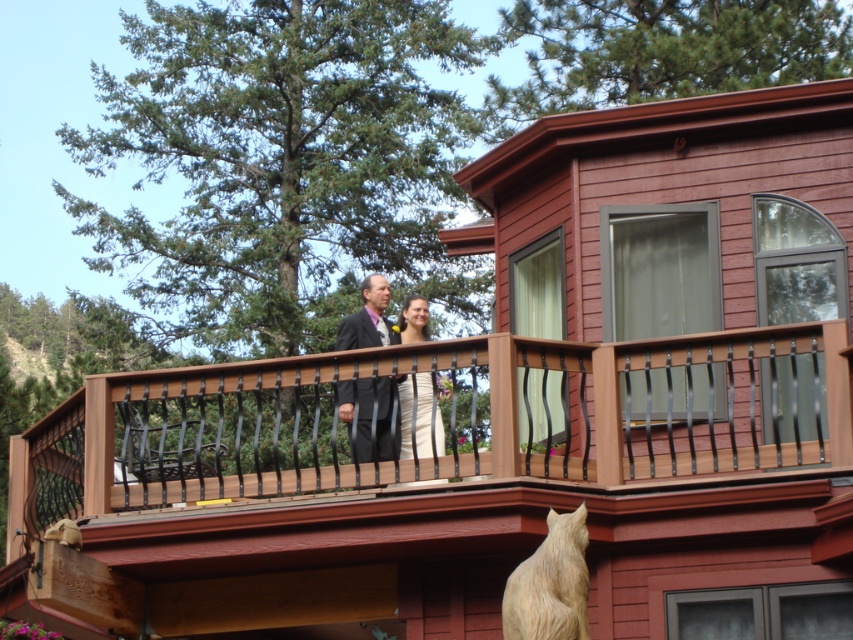
Who is higher up, dark suit at center or white satin dress at center?

white satin dress at center is higher up.

What are the coordinates of `dark suit at center` in the screenshot? It's located at (370, 417).